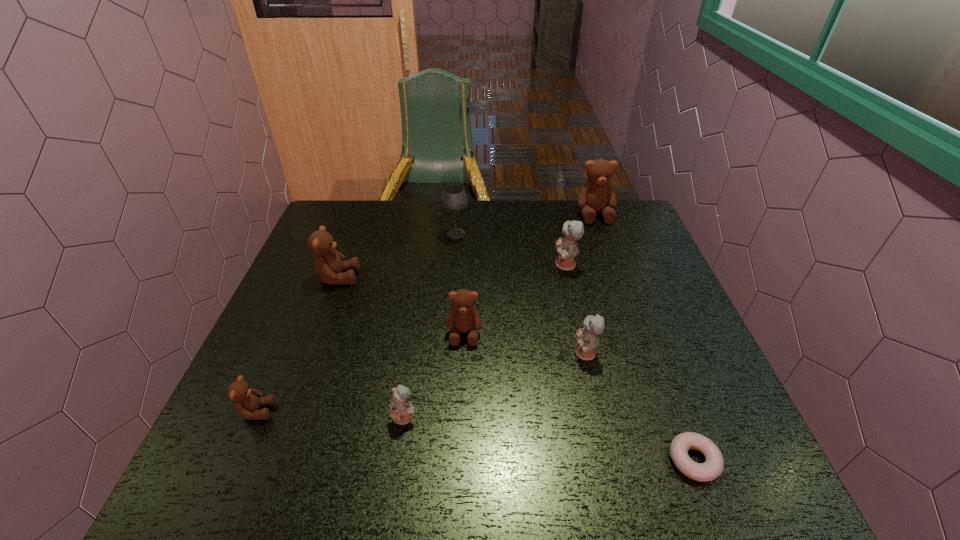
Identify the location of the tallest teddy bear. (597, 194).

This screenshot has width=960, height=540. I want to click on the farthest teddy bear, so (597, 194).

This screenshot has height=540, width=960. Find the location of `gray wineglass`. gray wineglass is located at coordinates (454, 199).

Find the location of a particular element. Image resolution: width=960 pixels, height=540 pixels. wineglass is located at coordinates (454, 199).

Where is `the biggest blue teddy bear`? Image resolution: width=960 pixels, height=540 pixels. the biggest blue teddy bear is located at coordinates (567, 248).

The image size is (960, 540). Find the location of `the third smallest brown teddy bear`. the third smallest brown teddy bear is located at coordinates (329, 264).

Where is `the second biggest blue teddy bear`? the second biggest blue teddy bear is located at coordinates (587, 337).

Locate an element on the screen. the third brown teddy bear from left to right is located at coordinates (463, 317).

What are the coordinates of `the third farthest brown teddy bear` in the screenshot? It's located at [463, 317].

Find the location of a particular element. This screenshot has width=960, height=540. the nearest brown teddy bear is located at coordinates (247, 401).